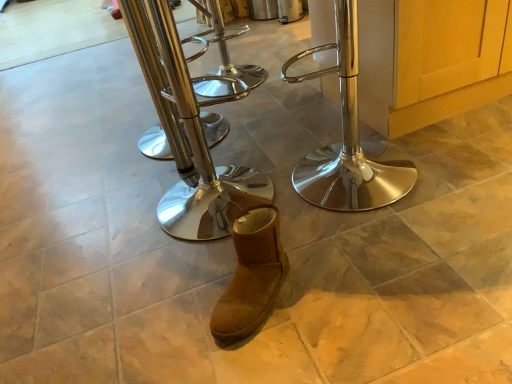
You are a GUI agent. You are given a task and a screenshot of the screen. Output one action in this format:
    pyautogui.click(x=<x>, y=<y>)
    Task: Click on the free area in between polished chrome stool at center, the second step stool viewed from the right, and brown suede boot at center
    The height and width of the screenshot is (384, 512).
    Given the screenshot: What is the action you would take?
    pyautogui.click(x=201, y=262)